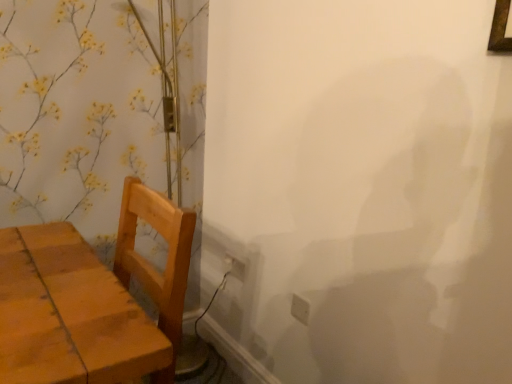
Question: Can you confirm if wooden table at left is taller than white plastic electric outlet at lower center, arranged as the 2th electric outlet when ordered from the bottom?

Choices:
 (A) yes
 (B) no

Answer: (A)

Question: Can you confirm if wooden table at left is shorter than white plastic electric outlet at lower center, acting as the 2th electric outlet starting from the right?

Choices:
 (A) no
 (B) yes

Answer: (A)

Question: Can you confirm if wooden table at left is thinner than white plastic electric outlet at lower center, which is the 1th electric outlet from top to bottom?

Choices:
 (A) no
 (B) yes

Answer: (A)

Question: Is white plastic electric outlet at lower center, which is the 1th electric outlet from top to bottom, completely or partially inside wooden table at left?

Choices:
 (A) yes
 (B) no

Answer: (B)

Question: From a real-world perspective, is wooden table at left positioned under white plastic electric outlet at lower center, arranged as the first electric outlet when viewed from the left, based on gravity?

Choices:
 (A) yes
 (B) no

Answer: (B)

Question: Considering the relative positions of wooden table at left and white plastic electric outlet at lower center, which is the 1th electric outlet from top to bottom, in the image provided, is wooden table at left to the left of white plastic electric outlet at lower center, which is the 1th electric outlet from top to bottom, from the viewer's perspective?

Choices:
 (A) no
 (B) yes

Answer: (B)

Question: Is white plastic electric outlet at lower center, arranged as the 2th electric outlet when ordered from the bottom, outside white plastic electric outlet at lower right, arranged as the first electric outlet when viewed from the front?

Choices:
 (A) yes
 (B) no

Answer: (A)

Question: Is the surface of white plastic electric outlet at lower center, arranged as the first electric outlet when viewed from the left, in direct contact with white plastic electric outlet at lower right, the 2th electric outlet positioned from the top?

Choices:
 (A) yes
 (B) no

Answer: (B)

Question: Does white plastic electric outlet at lower center, arranged as the 2th electric outlet when ordered from the bottom, appear on the left side of white plastic electric outlet at lower right, which is counted as the 1th electric outlet, starting from the right?

Choices:
 (A) no
 (B) yes

Answer: (B)

Question: Is white plastic electric outlet at lower center, acting as the 2th electric outlet starting from the right, positioned far away from white plastic electric outlet at lower right, which is counted as the 2th electric outlet, starting from the back?

Choices:
 (A) yes
 (B) no

Answer: (B)

Question: From the image's perspective, would you say white plastic electric outlet at lower center, which is the 1th electric outlet from top to bottom, is shown under white plastic electric outlet at lower right, which is counted as the 1th electric outlet, starting from the right?

Choices:
 (A) yes
 (B) no

Answer: (B)

Question: Does white plastic electric outlet at lower center, which is the 1th electric outlet from top to bottom, appear on the right side of white plastic electric outlet at lower right, the 2th electric outlet when ordered from left to right?

Choices:
 (A) no
 (B) yes

Answer: (A)

Question: From a real-world perspective, is white plastic electric outlet at lower right, arranged as the first electric outlet when viewed from the front, positioned over white plastic electric outlet at lower center, arranged as the first electric outlet when viewed from the left, based on gravity?

Choices:
 (A) no
 (B) yes

Answer: (B)